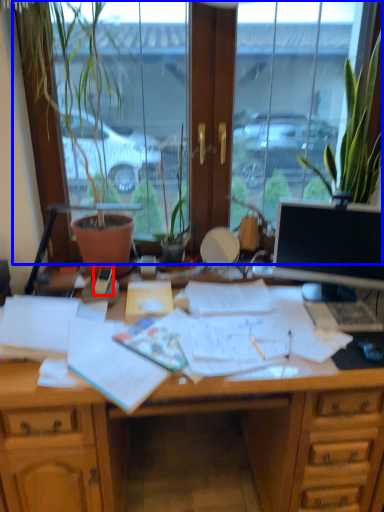
Question: Among these objects, which one is nearest to the camera, mobile phone (highlighted by a red box) or window (highlighted by a blue box)?

Choices:
 (A) mobile phone
 (B) window

Answer: (B)